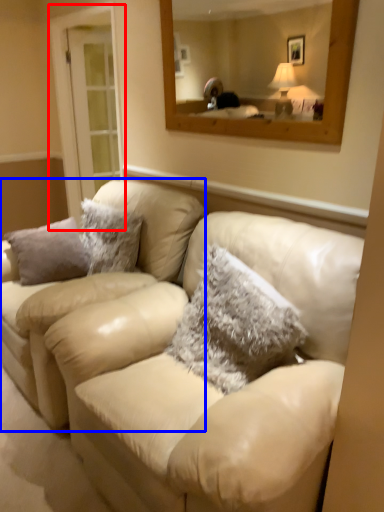
Question: Which object is closer to the camera taking this photo, glass door (highlighted by a red box) or couch (highlighted by a blue box)?

Choices:
 (A) glass door
 (B) couch

Answer: (B)